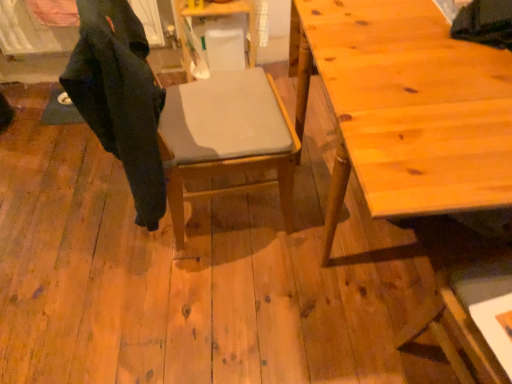
Question: Is wooden table at center, which is the second table in bottom-to-top order, wider or thinner than wooden table at right, acting as the 2th table starting from the left?

Choices:
 (A) wide
 (B) thin

Answer: (B)

Question: From the image's perspective, is wooden table at center, which is the second table in bottom-to-top order, located above or below wooden table at right, which is counted as the 1th table, starting from the front?

Choices:
 (A) above
 (B) below

Answer: (A)

Question: Estimate the real-world distances between objects in this image. Which object is farther from the dark matte fabric robe at left?

Choices:
 (A) matte gray cushion at center
 (B) wooden table at center, marked as the first table in a back-to-front arrangement
 (C) wooden table at right, which is counted as the 1th table, starting from the front

Answer: (B)

Question: Which object is positioned closest to the wooden table at center, marked as the first table in a back-to-front arrangement?

Choices:
 (A) matte gray cushion at center
 (B) wooden table at right, which is counted as the 2th table, starting from the back
 (C) dark matte fabric robe at left

Answer: (A)